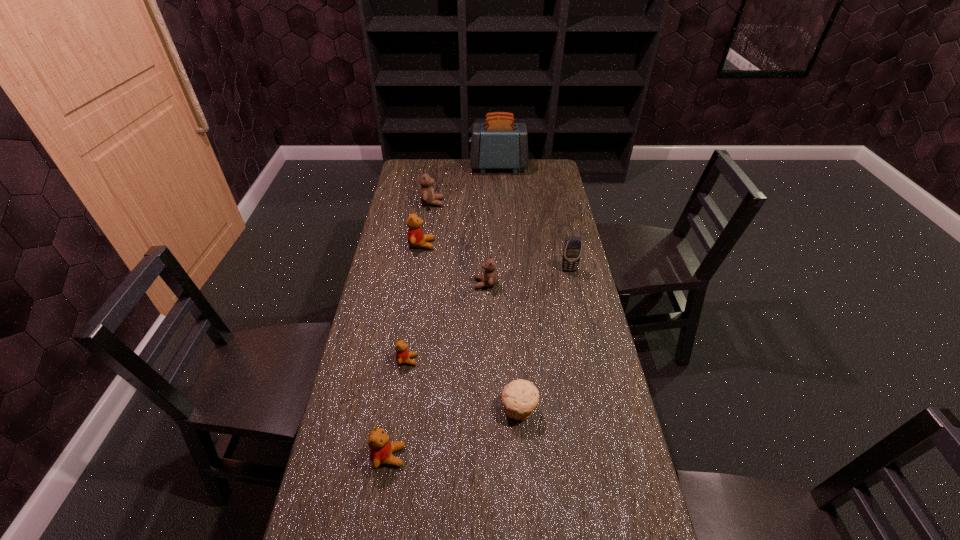
Locate an element on the screen. Image resolution: width=960 pixels, height=540 pixels. vacant region between the second biggest red teddy bear and the toaster is located at coordinates (444, 312).

Find the location of `vacant area that lies between the sixth nearest object and the nearer brown teddy bear`. vacant area that lies between the sixth nearest object and the nearer brown teddy bear is located at coordinates (453, 264).

At what (x,y) coordinates should I click in order to perform the action: click on vacant region between the toaster and the fourth farthest teddy bear. Please return your answer as a coordinate pair (x, y). The image size is (960, 540). Looking at the image, I should click on (453, 264).

Identify the location of object that stands as the second closest to the second nearest red teddy bear. This screenshot has width=960, height=540. [520, 397].

I want to click on object that can be found as the seventh closest to the sixth farthest object, so click(x=499, y=143).

Identify which teddy bear is located as the nearest to the fifth nearest object. Please provide its 2D coordinates. Your answer should be formatted as a tuple, i.e. [(x, y)], where the tuple contains the x and y coordinates of a point satisfying the conditions above.

[(489, 278)]

Locate which teddy bear ranks second in proximity to the left brown teddy bear. Please provide its 2D coordinates. Your answer should be formatted as a tuple, i.e. [(x, y)], where the tuple contains the x and y coordinates of a point satisfying the conditions above.

[(489, 278)]

Point out which brown teddy bear is positioned as the second nearest to the third farthest object. Please provide its 2D coordinates. Your answer should be formatted as a tuple, i.e. [(x, y)], where the tuple contains the x and y coordinates of a point satisfying the conditions above.

[(489, 278)]

I want to click on the closest red teddy bear relative to the nearest teddy bear, so click(x=403, y=356).

Where is `red teddy bear that is the third nearest to the rightmost object`? This screenshot has height=540, width=960. red teddy bear that is the third nearest to the rightmost object is located at coordinates (381, 449).